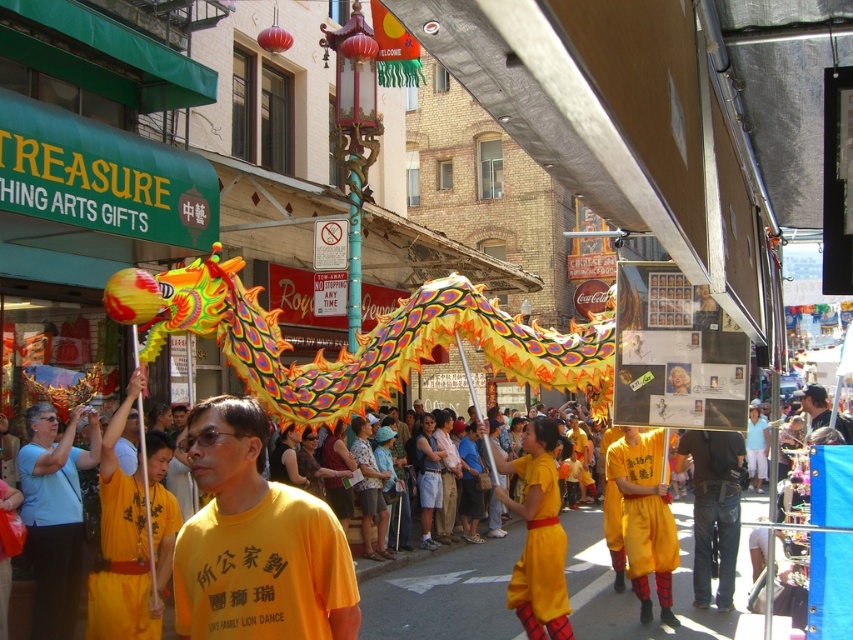
You are a photographer standing in the middle of the street. You want to capture a photo that includes both the yellow matte shorts at center and the denim jeans at lower right. Which of the two items should you focus on first if you want to ensure both are in frame without moving the camera?

The yellow matte shorts at center is taller than denim jeans at lower right, so focusing on the taller yellow matte shorts at center first will help ensure both are in frame.

You are a photographer trying to capture the dragon dance performance. You notice the yellow matte shirt at center and the denim jeans at lower right in your frame. Which clothing item should you focus on to ensure it appears closer to the front of the image?

The yellow matte shirt at center is above denim jeans at lower right, so focusing on the yellow matte shirt at center would make it appear closer to the front of the image.

You are a photographer trying to capture the vibrant dragon dance performance. You notice two participants wearing yellow matte shorts at center and denim jeans at lower right. Which participant should you focus on to get a clearer shot, and why?

You should focus on the yellow matte shorts at center because it is bigger than the denim jeans at lower right, making it easier to capture details in the photo.